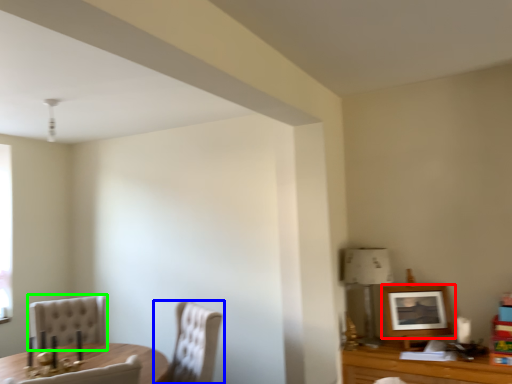
Question: Estimate the real-world distances between objects in this image. Which object is farther from picture frame (highlighted by a red box), chair (highlighted by a blue box) or chair (highlighted by a green box)?

Choices:
 (A) chair
 (B) chair

Answer: (B)